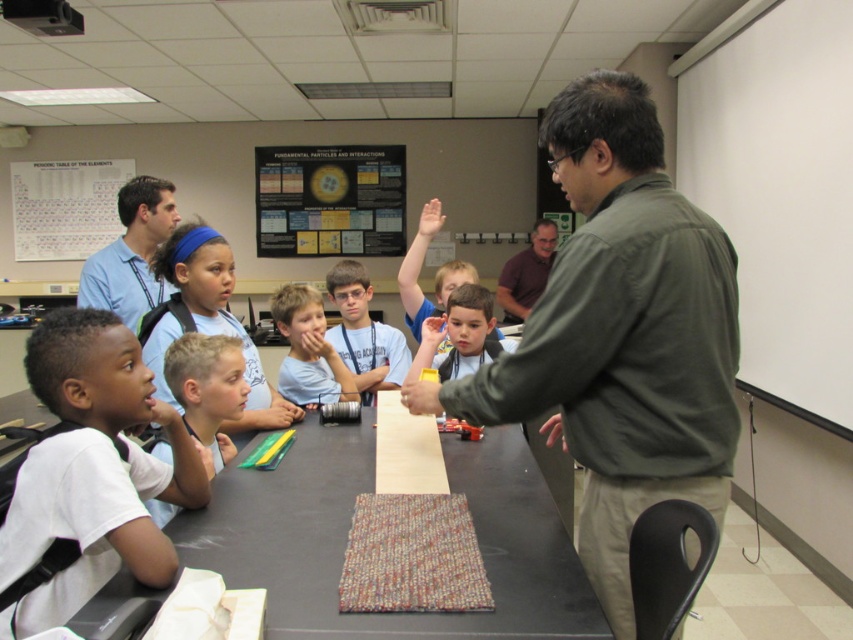
Does white matte shirt at lower left have a larger size compared to light blue shirt at upper left?

No, white matte shirt at lower left is not bigger than light blue shirt at upper left.

Between white matte shirt at lower left and light blue shirt at upper left, which one appears on the right side from the viewer's perspective?

Positioned to the right is white matte shirt at lower left.

Image resolution: width=853 pixels, height=640 pixels. What do you see at coordinates (91, 472) in the screenshot?
I see `white matte shirt at lower left` at bounding box center [91, 472].

You are a GUI agent. You are given a task and a screenshot of the screen. Output one action in this format:
    pyautogui.click(x=<x>, y=<y>)
    Task: Click on the white matte shirt at lower left
    The width and height of the screenshot is (853, 640).
    Given the screenshot: What is the action you would take?
    pyautogui.click(x=91, y=472)

Looking at this image, who is more distant from viewer, (312, 188) or (532, 273)?

Point (312, 188)

Who is positioned more to the right, metallic silver poster at upper center or purple shirt at center?

purple shirt at center is more to the right.

Between point (392, 214) and point (544, 269), which one is positioned in front?

Positioned in front is point (544, 269).

Find the location of `metallic silver poster at upper center`. metallic silver poster at upper center is located at coordinates 329,200.

Can you confirm if metallic silver poster at upper center is smaller than matte blue shirt at center?

No.

The width and height of the screenshot is (853, 640). What do you see at coordinates (329, 200) in the screenshot?
I see `metallic silver poster at upper center` at bounding box center [329, 200].

Identify the location of metallic silver poster at upper center. The width and height of the screenshot is (853, 640). [x=329, y=200].